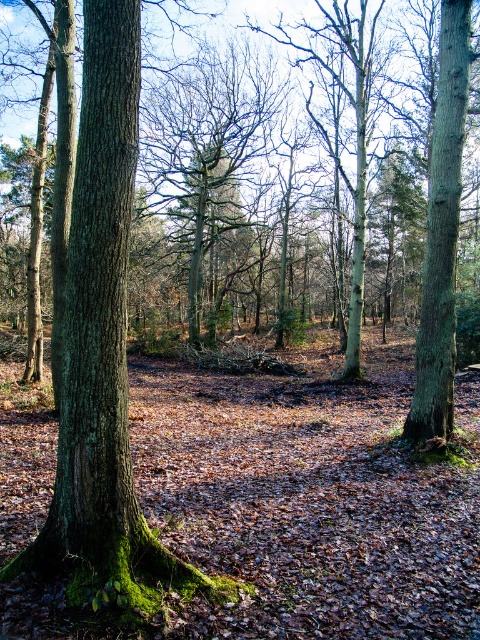
Who is higher up, green mossy bark tree trunk at left or smooth bark tree at center?

smooth bark tree at center

Does green mossy bark tree trunk at left appear over smooth bark tree at center?

Incorrect, green mossy bark tree trunk at left is not positioned above smooth bark tree at center.

Is point (46, 524) positioned after point (284, 81)?

No, (46, 524) is in front of (284, 81).

Where is `green mossy bark tree trunk at left`? green mossy bark tree trunk at left is located at coordinates (103, 355).

Is smooth bark tree at center bigger than green rough bark tree trunk at right?

Correct, smooth bark tree at center is larger in size than green rough bark tree trunk at right.

Can you confirm if smooth bark tree at center is wider than green rough bark tree trunk at right?

Indeed, smooth bark tree at center has a greater width compared to green rough bark tree trunk at right.

The width and height of the screenshot is (480, 640). Identify the location of smooth bark tree at center. (207, 147).

Who is positioned more to the right, green mossy bark tree trunk at left or green rough bark tree trunk at right?

green rough bark tree trunk at right is more to the right.

Can you confirm if green mossy bark tree trunk at left is thinner than green rough bark tree trunk at right?

Yes.

Is point (128, 84) positioned after point (453, 54)?

No, (128, 84) is in front of (453, 54).

Find the location of a particular element. green mossy bark tree trunk at left is located at coordinates (103, 355).